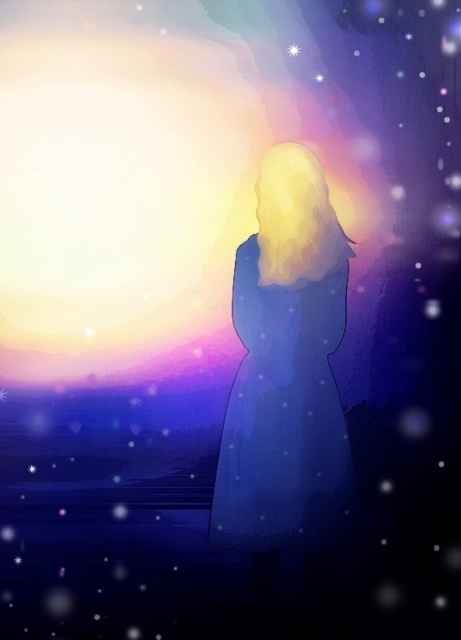
Question: Is matte blue dress at center further to camera compared to bright white star at upper center?

Choices:
 (A) yes
 (B) no

Answer: (A)

Question: Can you confirm if matte blue dress at center is smaller than bright white star at upper center?

Choices:
 (A) yes
 (B) no

Answer: (B)

Question: Which object appears closest to the camera in this image?

Choices:
 (A) matte blue dress at center
 (B) bright white star at upper center

Answer: (B)

Question: Can you confirm if matte blue dress at center is smaller than bright white star at upper center?

Choices:
 (A) yes
 (B) no

Answer: (B)